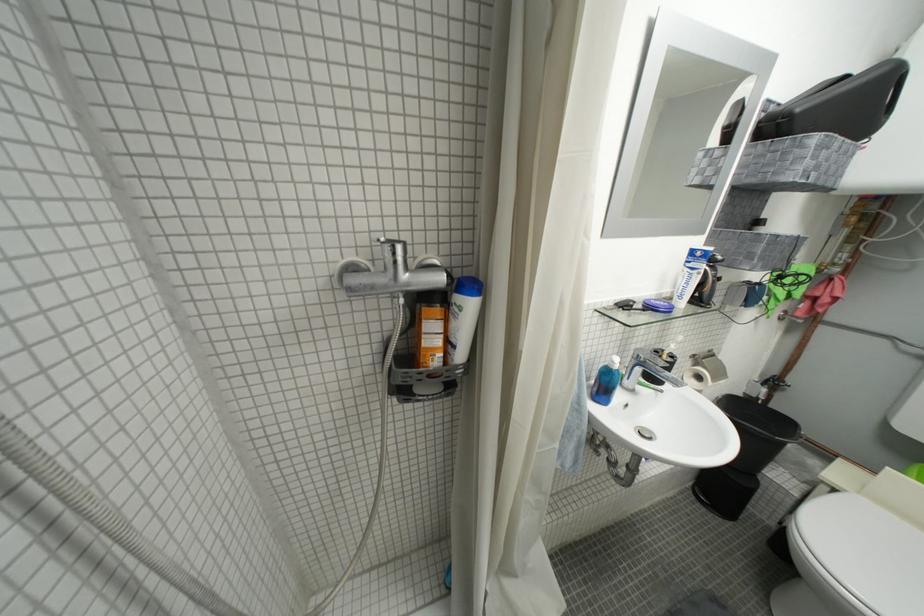
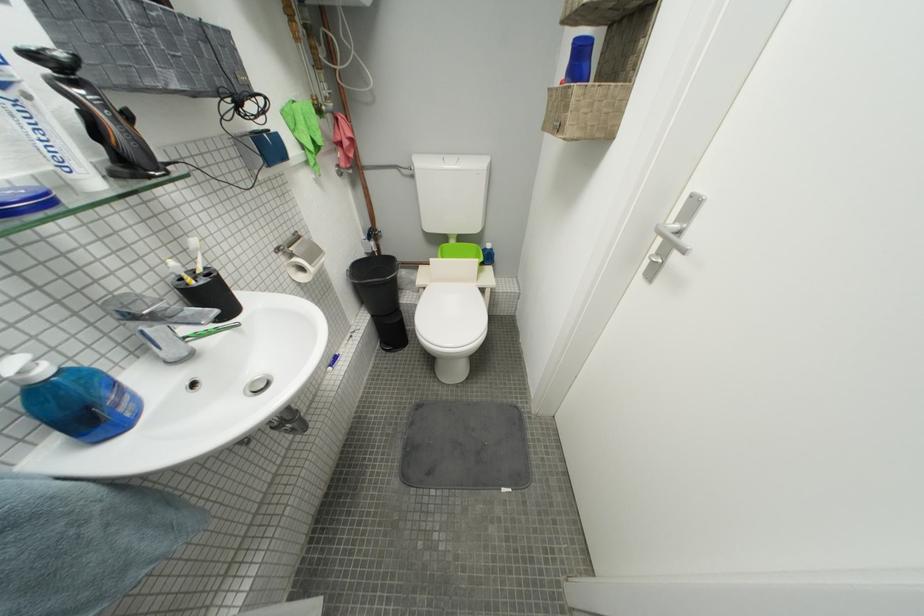
Find the pixel in the second image that matches pixel 724 278 in the first image.

(114, 108)